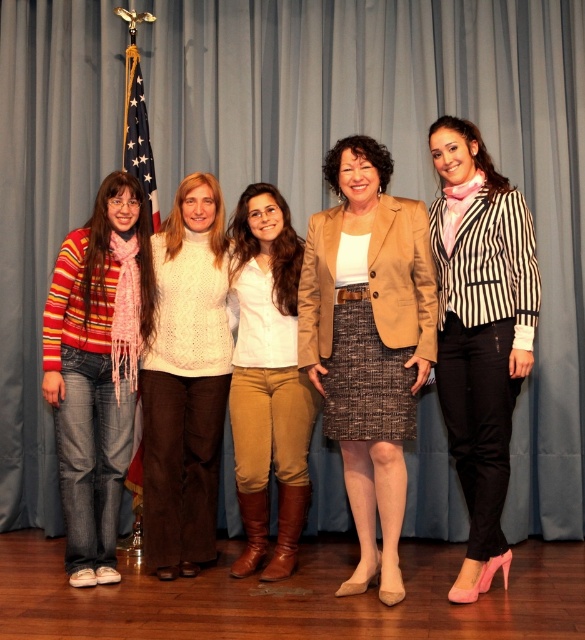
You are a photographer positioned in front of the five women. You need to adjust your camera focus to capture the brown textured blazer at center and the striped sweater at left. Which one should you focus on first to ensure it appears sharp in the photo?

The brown textured blazer at center is closer to the viewer than the striped sweater at left, so you should focus on the brown textured blazer at center first to ensure it appears sharp in the photo.

You are standing in front of the image and want to identify the person wearing the brown textured blazer at center. Based on their position relative to the other individuals, can you determine where this person is standing among the five women?

The brown textured blazer at center is located at point (x=369, y=340), which places it centrally among the five women standing side by side. Therefore, the person wearing the brown textured blazer at center is the third woman from the left.

You are standing in front of the image and want to know if the light brown leather boots at center are positioned to the right or left of the american flag at left. Based on the scene, can you determine their relative positions?

The light brown leather boots at center are located below the american flag at left, so they are positioned to the left of the flag.